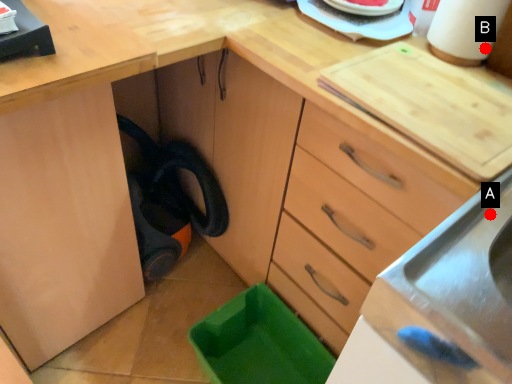
Question: Two points are circled on the image, labeled by A and B beside each circle. Which point is closer to the camera taking this photo?

Choices:
 (A) A is closer
 (B) B is closer

Answer: (A)